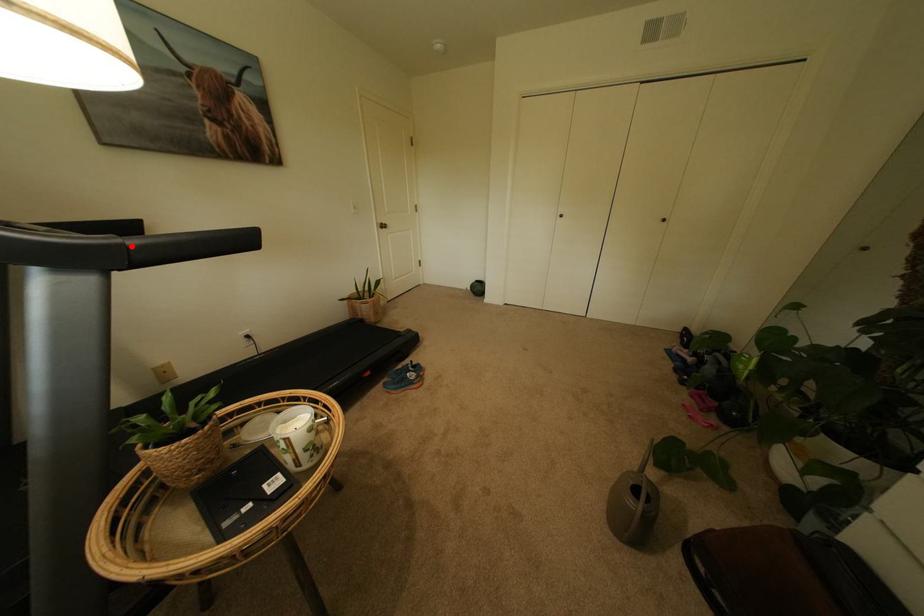
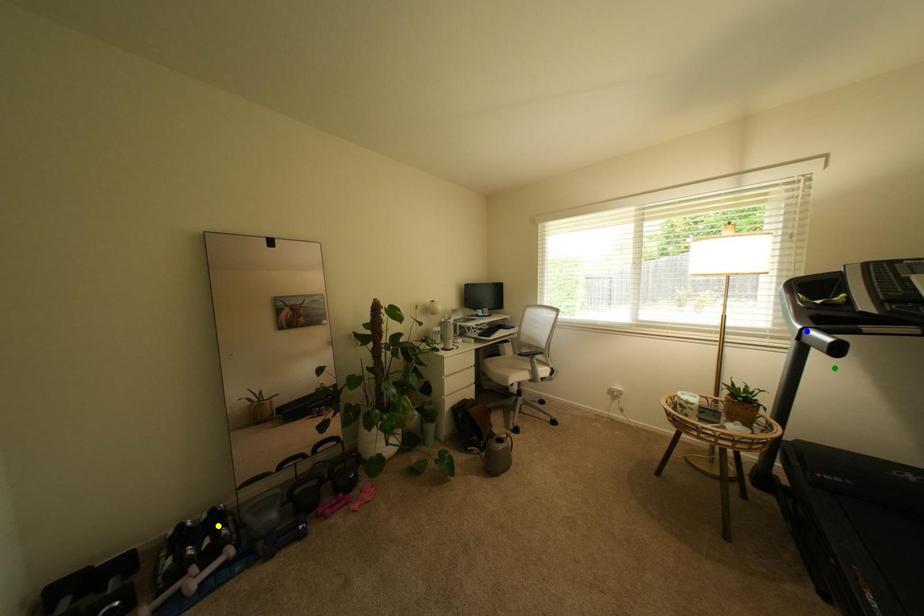
Question: I am providing you with two images of the same scene from different viewpoints. A red point is marked on the first image. You are given multiple points on the second image. Which point in image 2 represents the same 3d spot as the red point in image 1?

Choices:
 (A) blue point
 (B) green point
 (C) yellow point

Answer: (A)